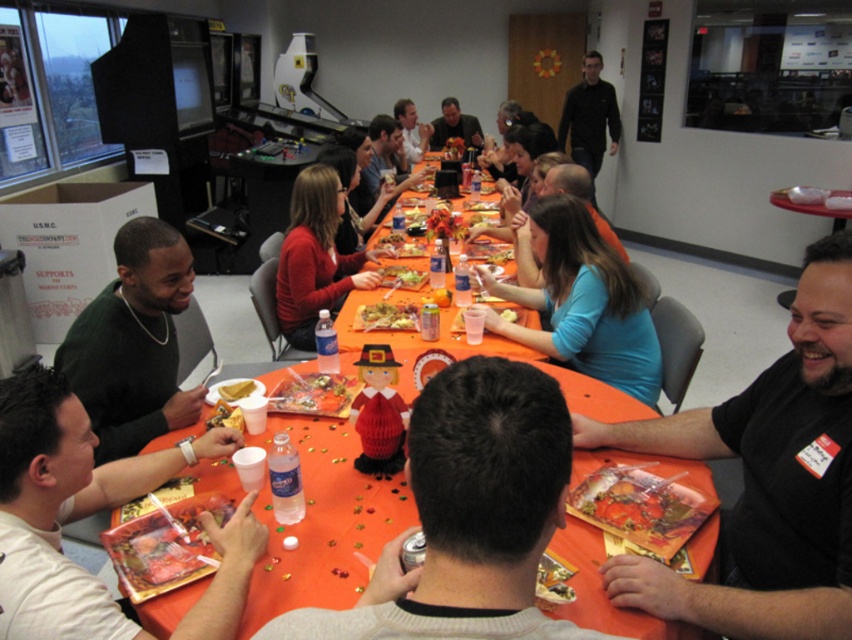
You are taking a photo of the table and want to focus on both the point at coordinates point (x=225, y=390) and point (x=493, y=209). Which point should you focus on first to ensure both are in focus?

You should focus on point (x=225, y=390) first because it is closer to the camera, so focusing on the closer point ensures both points will be in focus.